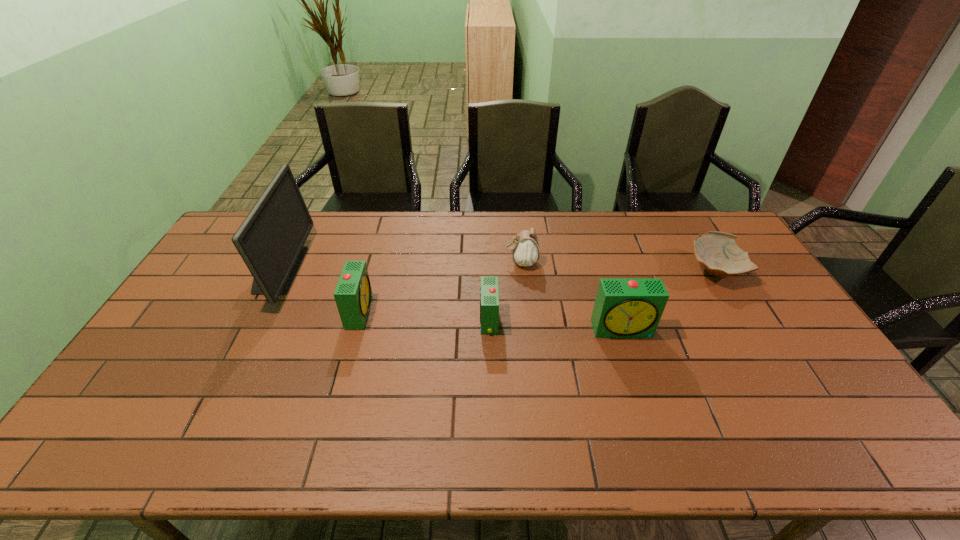
Find the location of a particular element. Image resolution: width=960 pixels, height=540 pixels. free point that keeps the alarm clocks evenly spaced on the right is located at coordinates (763, 339).